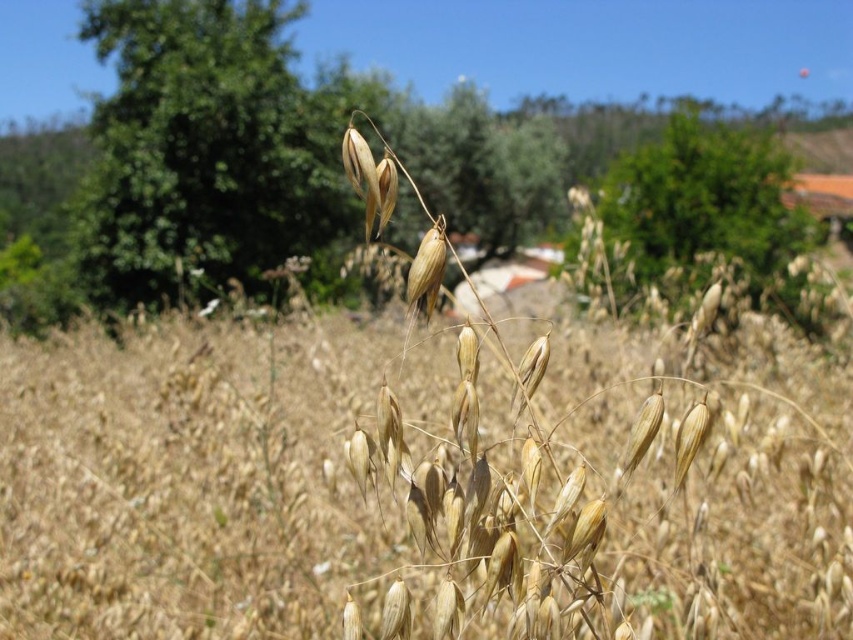
You are standing in a field of dry plants and need to locate two specific points marked in the image. The first point is at coordinates point (x=383, y=540), and the second is at point (x=637, y=168). From your current position, which point would appear closer to you?

Point (x=383, y=540) is in front of point (x=637, y=168), so it would appear closer to you.

You are a farmer checking your crops. You see the dry straw wheat at center and the green leafy tree at upper center. Which one is positioned to the left of the other?

The dry straw wheat at center is to the left of green leafy tree at upper center.